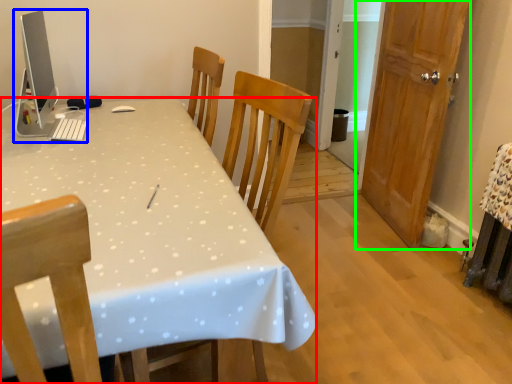
Question: Considering the real-world distances, which object is farthest from desk (highlighted by a red box)? desktop computer (highlighted by a blue box) or door (highlighted by a green box)?

Choices:
 (A) desktop computer
 (B) door

Answer: (B)